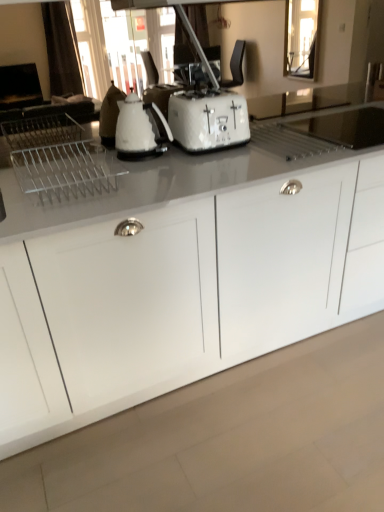
Question: From their relative heights in the image, would you say white glossy cabinet at center is taller or shorter than white glossy kettle at center?

Choices:
 (A) tall
 (B) short

Answer: (A)

Question: Do you think white glossy cabinet at center is within white glossy kettle at center, or outside of it?

Choices:
 (A) inside
 (B) outside

Answer: (B)

Question: Estimate the real-world distances between objects in this image. Which object is closer to the white glossy kettle at center?

Choices:
 (A) white glossy cabinet at center
 (B) white textured toaster at center

Answer: (B)

Question: Which is nearer to the white glossy kettle at center?

Choices:
 (A) white glossy cabinet at center
 (B) white textured toaster at center

Answer: (B)